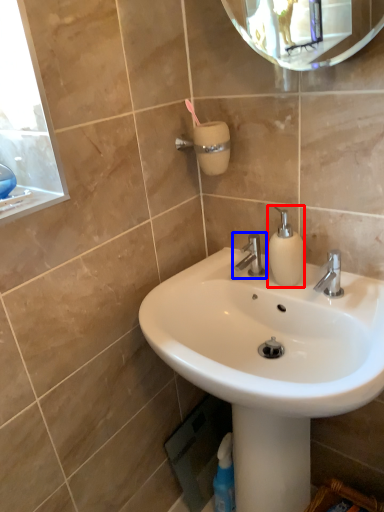
Question: Which object appears farthest to the camera in this image, soap dispenser (highlighted by a red box) or tap (highlighted by a blue box)?

Choices:
 (A) soap dispenser
 (B) tap

Answer: (B)